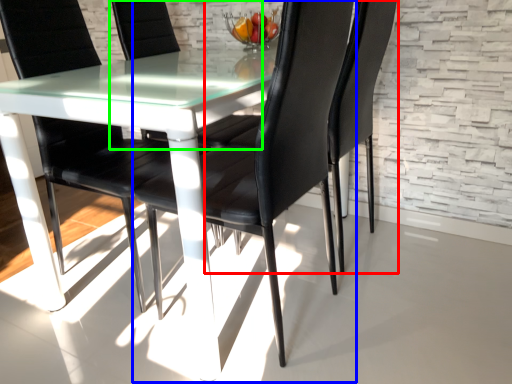
Question: Which object is the farthest from chair (highlighted by a red box)? Choose among these: chair (highlighted by a blue box) or chair (highlighted by a green box).

Choices:
 (A) chair
 (B) chair

Answer: (B)